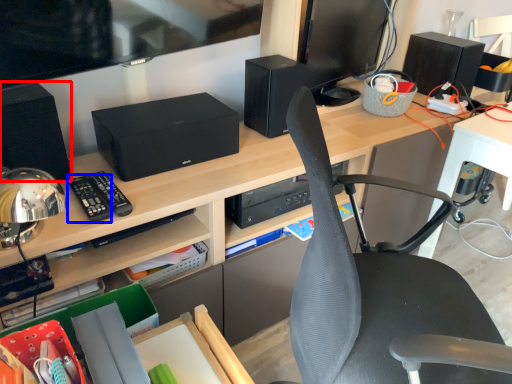
Question: Which object is further to the camera taking this photo, speaker (highlighted by a red box) or control (highlighted by a blue box)?

Choices:
 (A) speaker
 (B) control

Answer: (B)